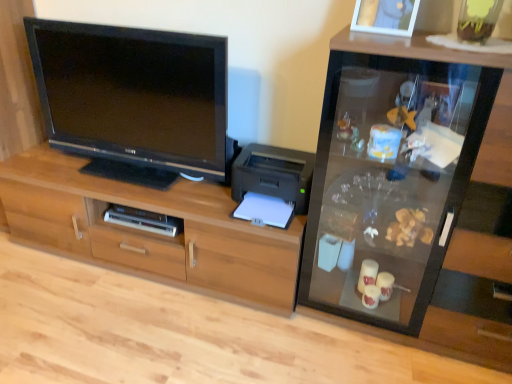
Question: Should I look upward or downward to see black glossy tv at left?

Choices:
 (A) down
 (B) up

Answer: (B)

Question: From a real-world perspective, does silver metallic dvd player at lower center stand above black glossy tv at left?

Choices:
 (A) yes
 (B) no

Answer: (B)

Question: Is silver metallic dvd player at lower center to the right of black glossy tv at left from the viewer's perspective?

Choices:
 (A) no
 (B) yes

Answer: (B)

Question: Is silver metallic dvd player at lower center further to the viewer compared to black glossy tv at left?

Choices:
 (A) no
 (B) yes

Answer: (B)

Question: Is silver metallic dvd player at lower center to the left of black glossy tv at left from the viewer's perspective?

Choices:
 (A) yes
 (B) no

Answer: (B)

Question: Is silver metallic dvd player at lower center not near black glossy tv at left?

Choices:
 (A) no
 (B) yes

Answer: (A)

Question: Are silver metallic dvd player at lower center and black glossy tv at left making contact?

Choices:
 (A) yes
 (B) no

Answer: (B)

Question: From the image's perspective, is wooden cabinet at center located beneath black glossy tv at left?

Choices:
 (A) no
 (B) yes

Answer: (B)

Question: Can you confirm if wooden cabinet at center is wider than black glossy tv at left?

Choices:
 (A) no
 (B) yes

Answer: (B)

Question: Is wooden cabinet at center touching black glossy tv at left?

Choices:
 (A) yes
 (B) no

Answer: (B)

Question: Is wooden cabinet at center aimed at black glossy tv at left?

Choices:
 (A) no
 (B) yes

Answer: (A)

Question: Is wooden cabinet at center taller than black glossy tv at left?

Choices:
 (A) no
 (B) yes

Answer: (A)

Question: Can you confirm if wooden cabinet at center is positioned to the left of black glossy tv at left?

Choices:
 (A) yes
 (B) no

Answer: (B)

Question: Is wooden cabinet at center positioned with its back to transparent glass cabinet at right?

Choices:
 (A) no
 (B) yes

Answer: (A)